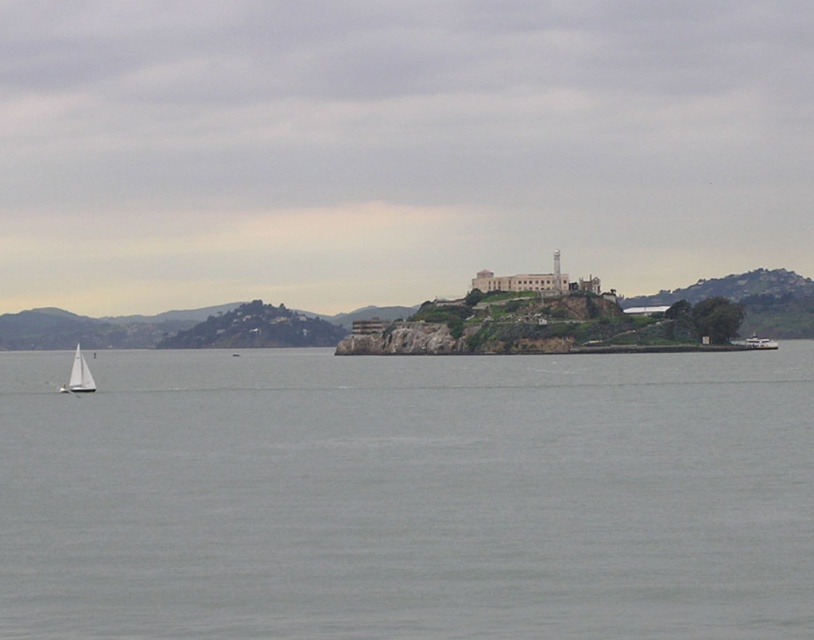
You are a photographer positioned at the edge of the rocky island. You notice the gray water at lower left and the white matte sailboat at lower left in your viewfinder. Which object is closer to you?

The gray water at lower left is closer to you because it is in front of the white matte sailboat at lower left.